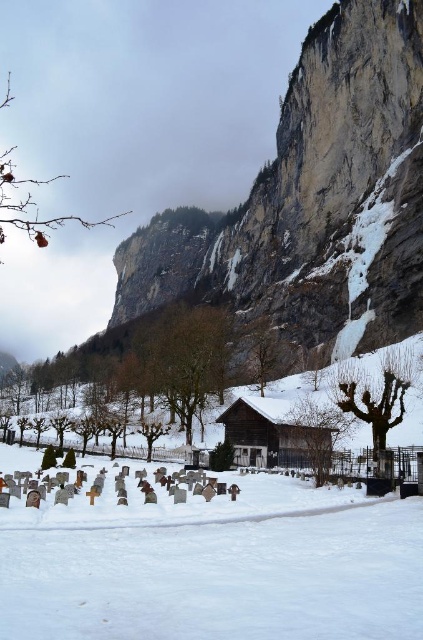
You are planning to build a small garden between the white powdery snow at center and the wooden cabin at center. Based on the scene, which area has more space to accommodate the garden?

The white powdery snow at center might be wider than wooden cabin at center, so the area near the white powdery snow at center has more space for the garden.

You are standing at the edge of the cliff in the winter scene. You see the white powdery snow at center and the wooden cabin at center. Which object is closer to you?

The white powdery snow at center is closer to the viewer than the wooden cabin at center.